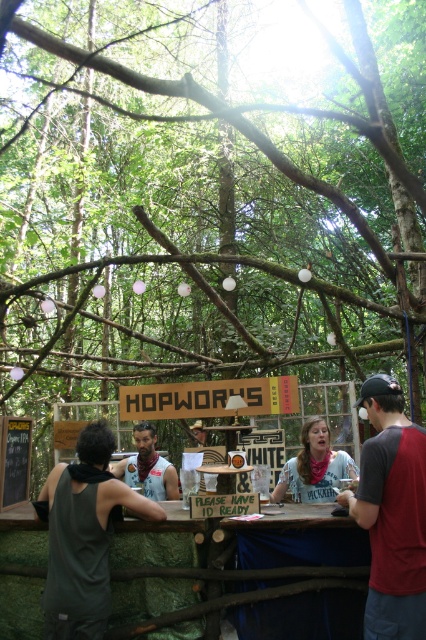
In the scene shown: Can you confirm if gray/red t-shirt at right is positioned above white cotton shirt at center?

Yes.

Based on the photo, does gray/red t-shirt at right appear under white cotton shirt at center?

Incorrect, gray/red t-shirt at right is not positioned below white cotton shirt at center.

Where is `gray/red t-shirt at right`? This screenshot has height=640, width=426. gray/red t-shirt at right is located at coordinates (391, 513).

Is gray/red t-shirt at right shorter than matte gray tank top at center?

In fact, gray/red t-shirt at right may be taller than matte gray tank top at center.

Who is more forward, (380, 406) or (166, 493)?

Point (380, 406) is in front.

Find the location of a particular element. gray/red t-shirt at right is located at coordinates [x=391, y=513].

Who is higher up, white cotton shirt at center or matte gray tank top at center?

white cotton shirt at center

Between white cotton shirt at center and matte gray tank top at center, which one has less height?

white cotton shirt at center is shorter.

Where is `white cotton shirt at center`? Image resolution: width=426 pixels, height=640 pixels. white cotton shirt at center is located at coordinates (314, 467).